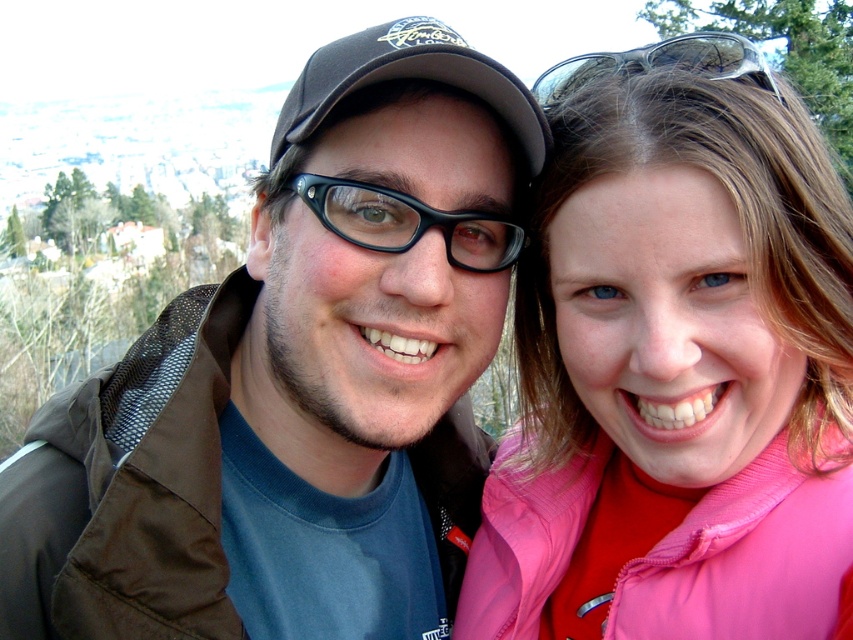
Question: Is matte black jacket at center positioned behind pink fabric jacket at upper right?

Choices:
 (A) yes
 (B) no

Answer: (A)

Question: Is the position of pink fabric jacket at upper right less distant than that of clear plastic goggles at upper right?

Choices:
 (A) no
 (B) yes

Answer: (B)

Question: Which object is closer to the camera taking this photo?

Choices:
 (A) clear plastic goggles at upper right
 (B) pink fabric jacket at upper right
 (C) matte black jacket at center

Answer: (B)

Question: Estimate the real-world distances between objects in this image. Which object is closer to the clear plastic goggles at upper right?

Choices:
 (A) pink fabric jacket at upper right
 (B) matte black jacket at center

Answer: (A)

Question: Which object is closer to the camera taking this photo?

Choices:
 (A) matte black jacket at center
 (B) clear plastic goggles at upper right

Answer: (A)

Question: Observing the image, what is the correct spatial positioning of matte black jacket at center in reference to clear plastic goggles at upper right?

Choices:
 (A) right
 (B) left

Answer: (B)